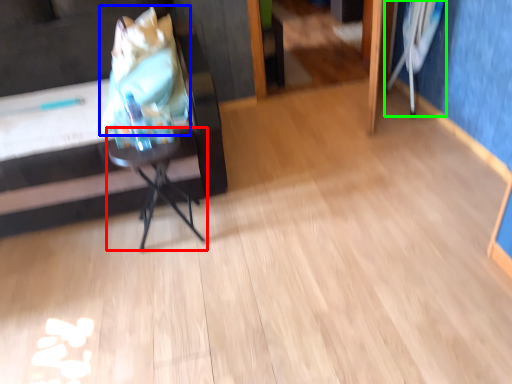
Question: Considering the real-world distances, which object is farthest from table (highlighted by a red box)? grocery bag (highlighted by a blue box) or swivel chair (highlighted by a green box)?

Choices:
 (A) grocery bag
 (B) swivel chair

Answer: (B)